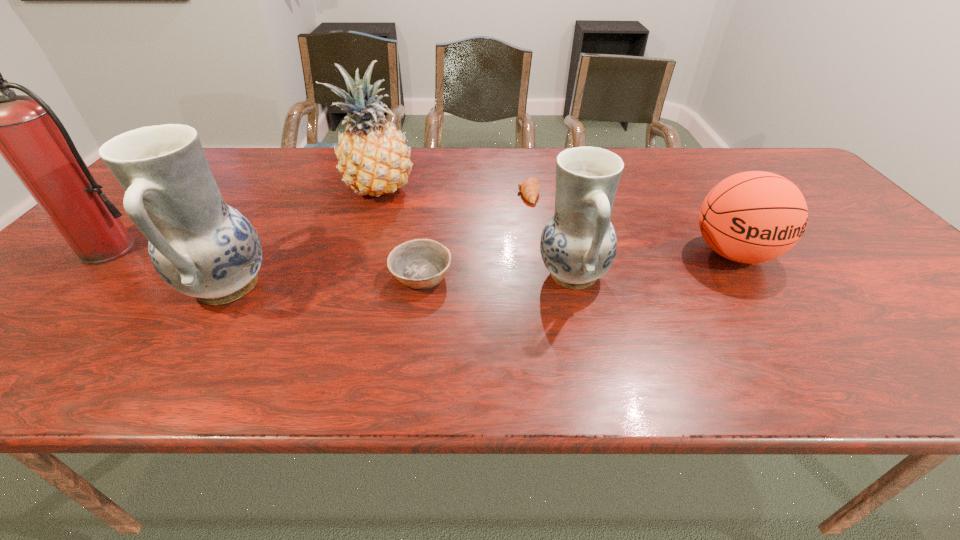
Identify the location of the shortest object. The width and height of the screenshot is (960, 540). pyautogui.click(x=530, y=187).

Image resolution: width=960 pixels, height=540 pixels. In order to click on free region located 0.160m on the left of the sixth object from right to left in this screenshot , I will do `click(111, 286)`.

Locate an element on the screen. The width and height of the screenshot is (960, 540). vacant space situated on the front of the fourth shortest object is located at coordinates (587, 331).

Locate an element on the screen. This screenshot has width=960, height=540. vacant space located 0.390m on the left of the pineapple is located at coordinates (206, 190).

What are the coordinates of `free spot located on the side with logo of the rightmost object` in the screenshot? It's located at (788, 334).

The height and width of the screenshot is (540, 960). I want to click on blank area located on the right of the bowl, so click(621, 275).

Locate an element on the screen. Image resolution: width=960 pixels, height=540 pixels. vacant space located on the front of the crescent roll is located at coordinates (536, 237).

The height and width of the screenshot is (540, 960). In order to click on pineapple that is at the far edge in this screenshot , I will do `click(373, 158)`.

I want to click on crescent roll at the far edge, so click(x=530, y=187).

Locate an element on the screen. object that is at the left edge is located at coordinates (24, 130).